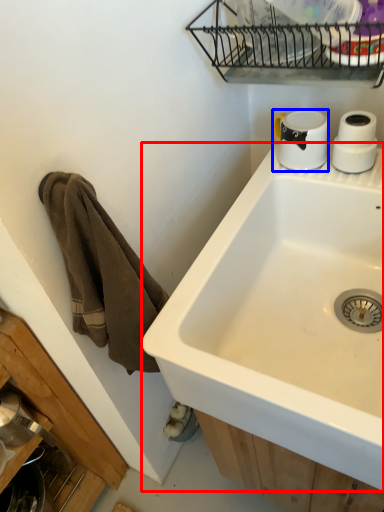
Question: Which object appears farthest to the camera in this image, sink (highlighted by a red box) or coffee cup (highlighted by a blue box)?

Choices:
 (A) sink
 (B) coffee cup

Answer: (B)